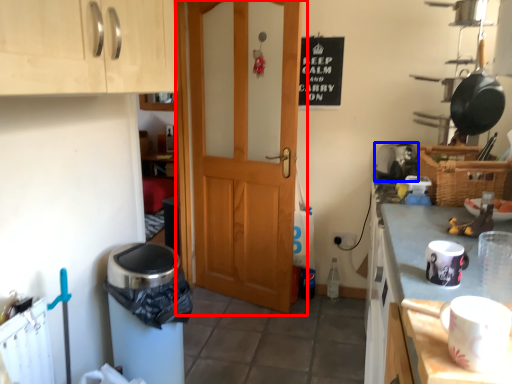
Question: Which object appears farthest to the camera in this image, door (highlighted by a red box) or appliance (highlighted by a blue box)?

Choices:
 (A) door
 (B) appliance

Answer: (B)